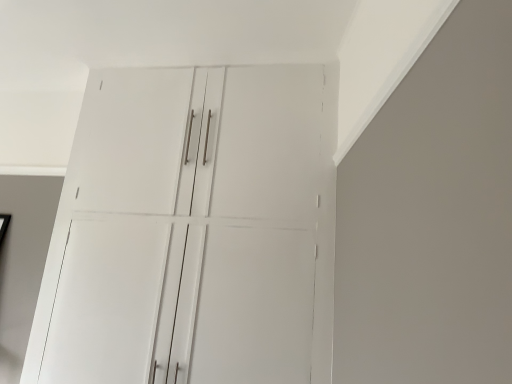
Where is `white glossy cabinet at upper center`? Image resolution: width=512 pixels, height=384 pixels. white glossy cabinet at upper center is located at coordinates (193, 231).

The width and height of the screenshot is (512, 384). Describe the element at coordinates (193, 231) in the screenshot. I see `white glossy cabinet at upper center` at that location.

You are a GUI agent. You are given a task and a screenshot of the screen. Output one action in this format:
    pyautogui.click(x=<x>, y=<y>)
    Task: Click on the white glossy cabinet at upper center
    
    Given the screenshot: What is the action you would take?
    pyautogui.click(x=193, y=231)